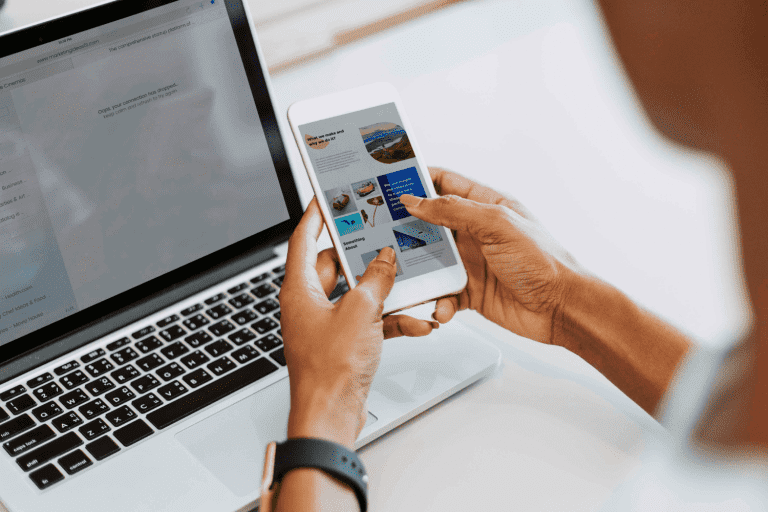
Identify the location of phone. (356, 98).